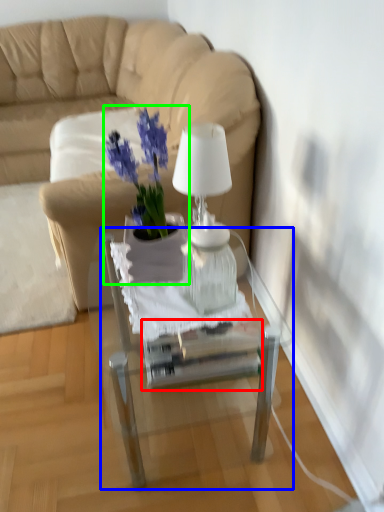
Question: Based on their relative distances, which object is farther from glass box (highlighted by a red box)? Choose from table (highlighted by a blue box) and houseplant (highlighted by a green box).

Choices:
 (A) table
 (B) houseplant

Answer: (B)